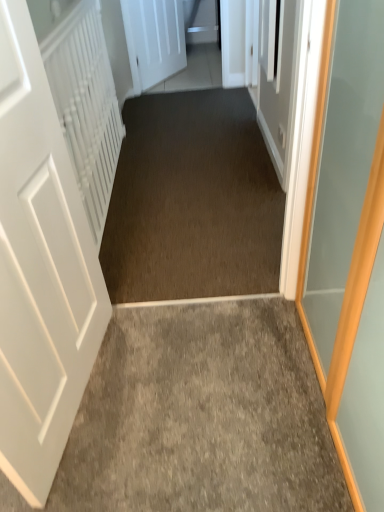
Question: Is dark brown carpet at center to the left or to the right of white textured radiator at left in the image?

Choices:
 (A) right
 (B) left

Answer: (A)

Question: Considering the positions of dark brown carpet at center and white textured radiator at left in the image, is dark brown carpet at center wider or thinner than white textured radiator at left?

Choices:
 (A) wide
 (B) thin

Answer: (A)

Question: Which object is the closest to the dark brown carpet at center?

Choices:
 (A) gray carpet at center
 (B) white textured radiator at left
 (C) white matte door at upper center, which appears as the second door when viewed from the front
 (D) white matte door at left, the first door from the front

Answer: (B)

Question: Which is farther from the white textured radiator at left?

Choices:
 (A) dark brown carpet at center
 (B) white matte door at upper center, acting as the 1th door starting from the top
 (C) gray carpet at center
 (D) white matte door at left, the first door from the front

Answer: (B)